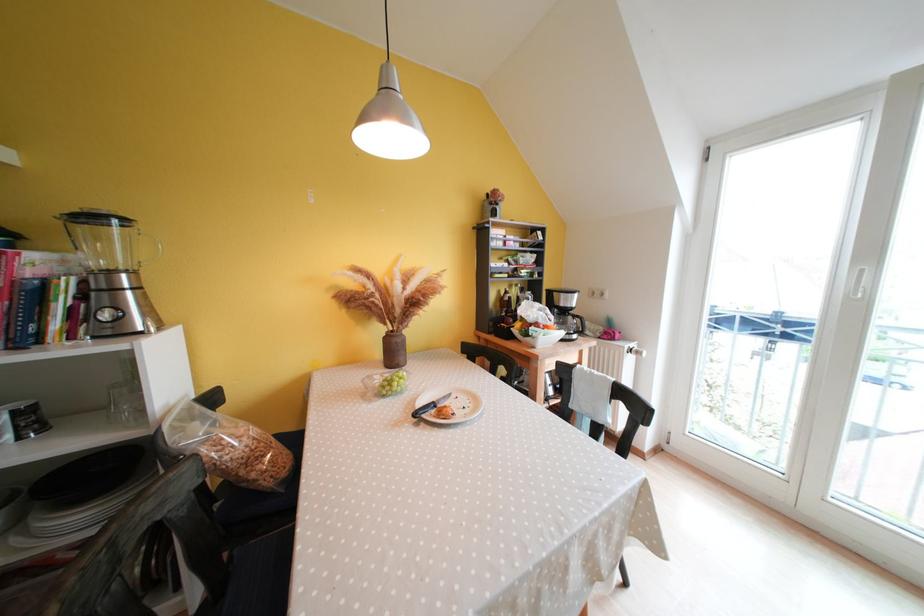
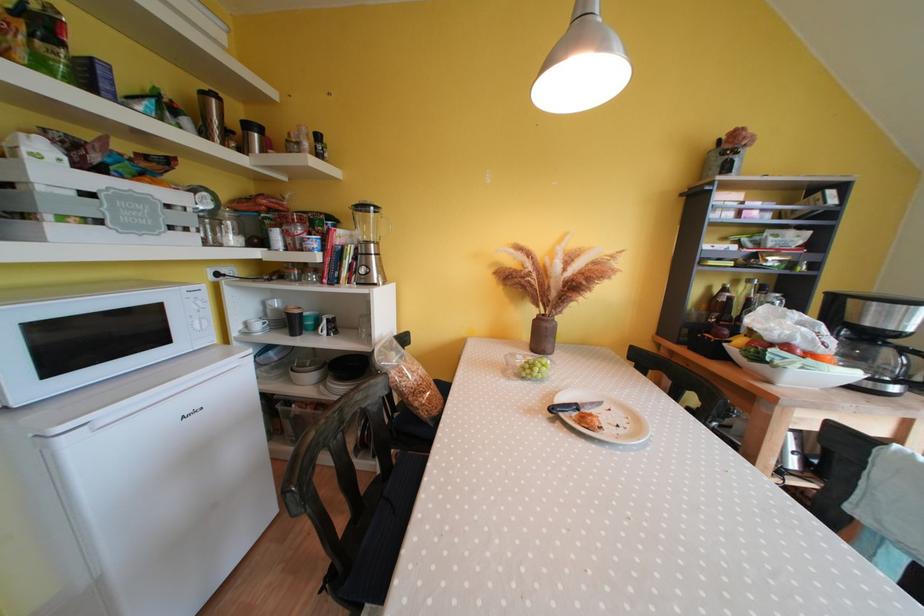
The point at (566, 337) is marked in the first image. Where is the corresponding point in the second image?

(858, 378)